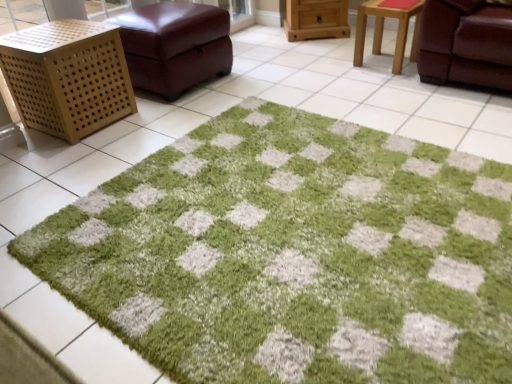
Question: From the image's perspective, is green shaggy rug at center positioned above or below wooden stool at upper right?

Choices:
 (A) above
 (B) below

Answer: (B)

Question: Based on their sizes in the image, would you say green shaggy rug at center is bigger or smaller than wooden stool at upper right?

Choices:
 (A) small
 (B) big

Answer: (B)

Question: Estimate the real-world distances between objects in this image. Which object is closer to the green shaggy rug at center?

Choices:
 (A) wooden lattice cube at left, marked as the first furniture in a left-to-right arrangement
 (B) wooden stool at upper right
 (C) wooden cabinet at upper center, the 3th furniture viewed from the left
 (D) leather ottoman at upper left, placed as the 2th furniture when sorted from left to right

Answer: (A)

Question: Which object is the closest to the wooden cabinet at upper center, which ranks as the 1th furniture in right-to-left order?

Choices:
 (A) green shaggy rug at center
 (B) wooden lattice cube at left, the 3th furniture in the right-to-left sequence
 (C) leather ottoman at upper left, the 2th furniture in the right-to-left sequence
 (D) wooden stool at upper right

Answer: (D)